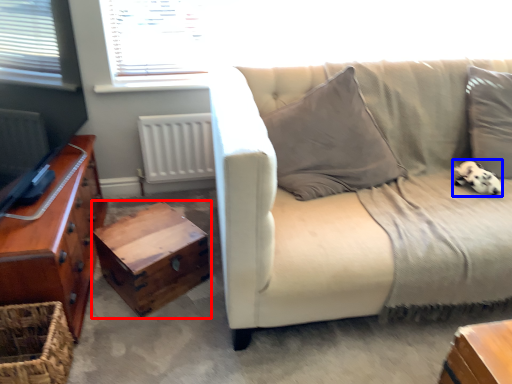
Question: Which point is further to the camera, table (highlighted by a red box) or animal (highlighted by a blue box)?

Choices:
 (A) table
 (B) animal

Answer: (B)